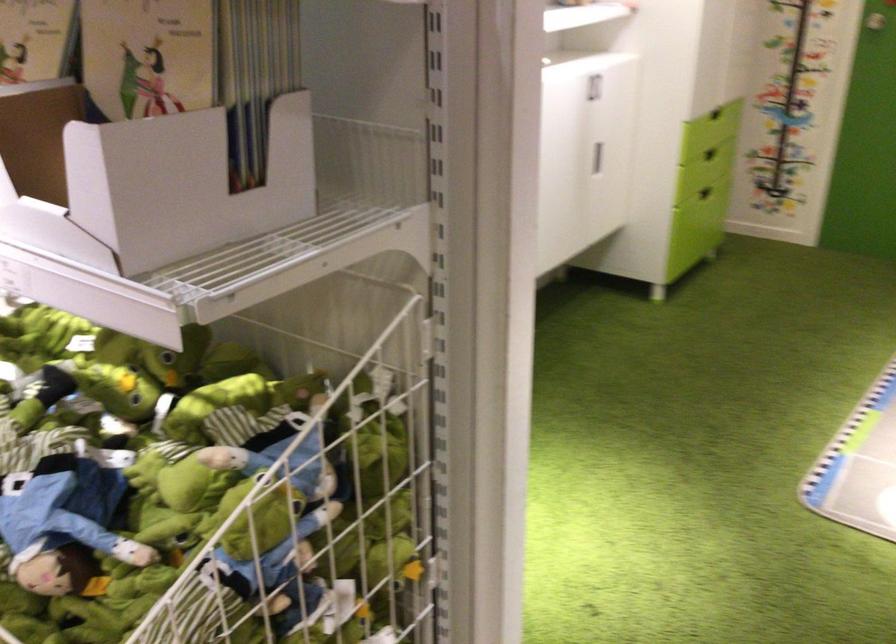
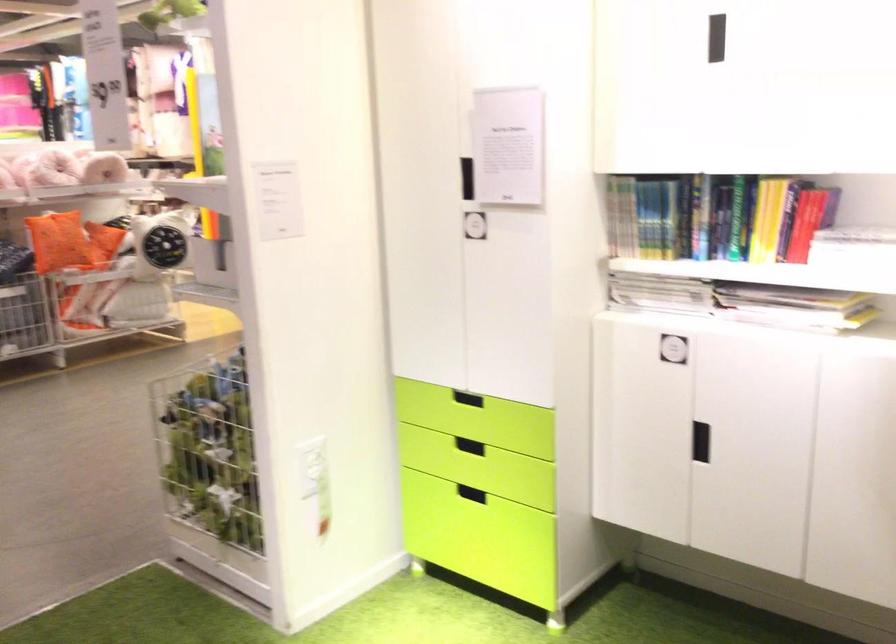
Question: I am providing you with two images of the same scene from different viewpoints. After the viewpoint changes to image2, which objects are now occluded?

Choices:
 (A) orange square pillow
 (B) green-lidded container
 (C) thin book
 (D) recessed black handle

Answer: (C)